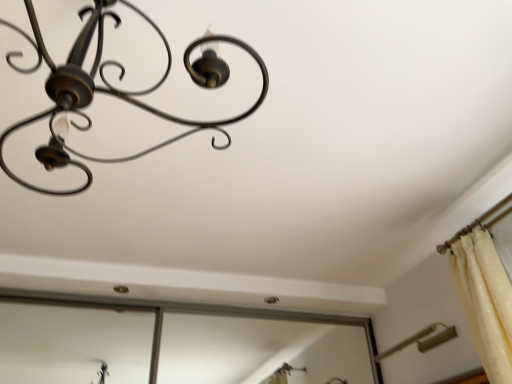
Question: Does matte black chandelier at upper left, which is the 2th lamp in right-to-left order, have a greater height compared to metallic gold lamp at lower right, acting as the 1th lamp starting from the right?

Choices:
 (A) yes
 (B) no

Answer: (A)

Question: Considering the relative sizes of matte black chandelier at upper left, which is the 2th lamp in right-to-left order, and metallic gold lamp at lower right, marked as the 2th lamp in a left-to-right arrangement, in the image provided, is matte black chandelier at upper left, which is the 2th lamp in right-to-left order, bigger than metallic gold lamp at lower right, marked as the 2th lamp in a left-to-right arrangement,?

Choices:
 (A) yes
 (B) no

Answer: (A)

Question: Considering the relative sizes of matte black chandelier at upper left, the 1th lamp viewed from the left, and metallic gold lamp at lower right, which is the first lamp from bottom to top, in the image provided, is matte black chandelier at upper left, the 1th lamp viewed from the left, shorter than metallic gold lamp at lower right, which is the first lamp from bottom to top,?

Choices:
 (A) no
 (B) yes

Answer: (A)

Question: Is matte black chandelier at upper left, the first lamp viewed from the top, at the right side of metallic gold lamp at lower right, which is the second lamp from top to bottom?

Choices:
 (A) no
 (B) yes

Answer: (A)

Question: Does matte black chandelier at upper left, which is the 2th lamp in back-to-front order, touch metallic gold lamp at lower right, acting as the second lamp starting from the front?

Choices:
 (A) no
 (B) yes

Answer: (A)

Question: Is matte black chandelier at upper left, which is the 2th lamp in back-to-front order, facing towards metallic gold lamp at lower right, acting as the 1th lamp starting from the right?

Choices:
 (A) yes
 (B) no

Answer: (B)

Question: From a real-world perspective, is metallic gold lamp at lower right, which is the second lamp from top to bottom, below matte black chandelier at upper left, the 1th lamp viewed from the left?

Choices:
 (A) no
 (B) yes

Answer: (B)

Question: Can you confirm if metallic gold lamp at lower right, acting as the 1th lamp starting from the right, is wider than matte black chandelier at upper left, the 1th lamp viewed from the left?

Choices:
 (A) no
 (B) yes

Answer: (A)

Question: Can you confirm if metallic gold lamp at lower right, marked as the 2th lamp in a left-to-right arrangement, is thinner than matte black chandelier at upper left, the first lamp viewed from the top?

Choices:
 (A) no
 (B) yes

Answer: (B)

Question: Is matte black chandelier at upper left, which is the 2th lamp in right-to-left order, a part of metallic gold lamp at lower right, acting as the 1th lamp starting from the right?

Choices:
 (A) yes
 (B) no

Answer: (B)

Question: Can you confirm if metallic gold lamp at lower right, acting as the second lamp starting from the front, is positioned to the left of matte black chandelier at upper left, which ranks as the first lamp in front-to-back order?

Choices:
 (A) no
 (B) yes

Answer: (A)

Question: Can you confirm if metallic gold lamp at lower right, which is the first lamp from bottom to top, is smaller than matte black chandelier at upper left, which is the 2th lamp in right-to-left order?

Choices:
 (A) yes
 (B) no

Answer: (A)

Question: Which is correct: matte black chandelier at upper left, the first lamp viewed from the top, is inside metallic gold lamp at lower right, which is the first lamp from bottom to top, or outside of it?

Choices:
 (A) inside
 (B) outside

Answer: (B)